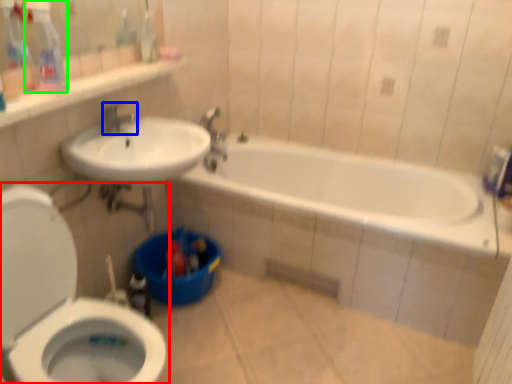
Question: Considering the real-world distances, which object is closest to toilet (highlighted by a red box)? tap (highlighted by a blue box) or cleaning product (highlighted by a green box).

Choices:
 (A) tap
 (B) cleaning product

Answer: (B)